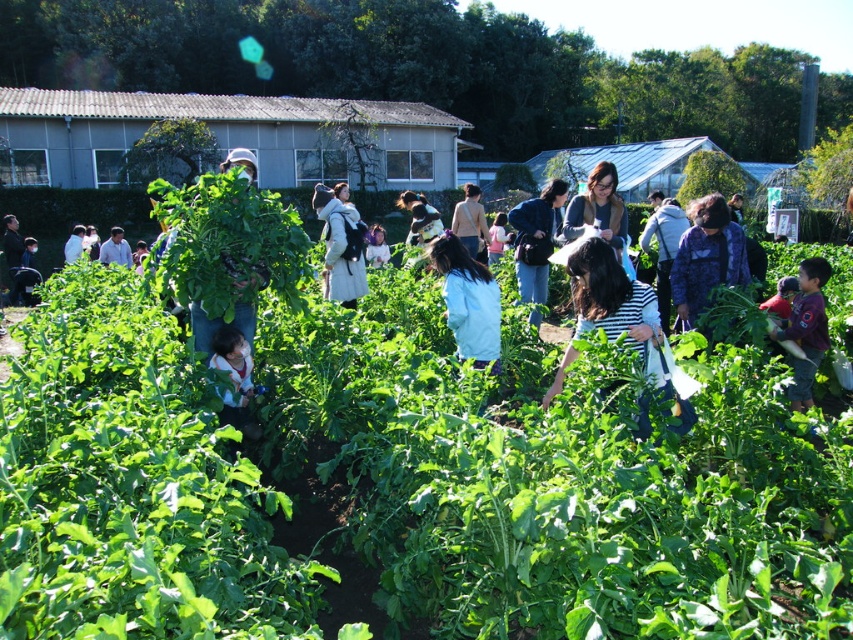
Is blue patterned jacket at center to the left of matte green shirt at center from the viewer's perspective?

In fact, blue patterned jacket at center is to the right of matte green shirt at center.

Is point (688, 216) closer to camera compared to point (254, 426)?

That is False.

The image size is (853, 640). Find the location of `blue patterned jacket at center`. blue patterned jacket at center is located at coordinates (706, 257).

Does point (222, 394) come farther from viewer compared to point (468, 192)?

No, it is in front of (468, 192).

Does matte green shirt at center have a greater width compared to light brown fabric jacket at center?

Incorrect, matte green shirt at center's width does not surpass light brown fabric jacket at center's.

The width and height of the screenshot is (853, 640). What are the coordinates of `matte green shirt at center` in the screenshot? It's located at (234, 378).

Between striped cotton shirt at center and light brown fabric jacket at center, which one appears on the left side from the viewer's perspective?

light brown fabric jacket at center

Between point (583, 308) and point (482, 240), which one is positioned behind?

Point (482, 240)

Which is behind, point (654, 324) or point (479, 188)?

The point (479, 188) is behind.

You are a GUI agent. You are given a task and a screenshot of the screen. Output one action in this format:
    pyautogui.click(x=<x>, y=<y>)
    Task: Click on the striped cotton shirt at center
    The height and width of the screenshot is (640, 853).
    Given the screenshot: What is the action you would take?
    pyautogui.click(x=610, y=296)